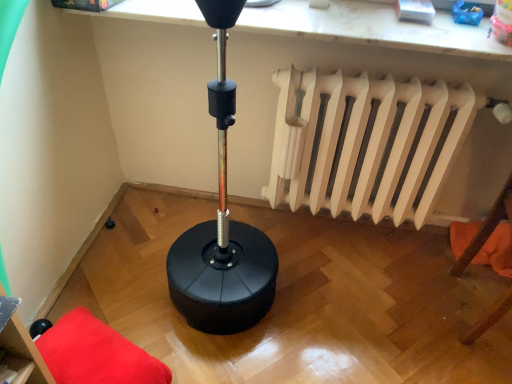
Question: Does black rubber punching bag at upper center have a greater width compared to matte black stool at lower left, marked as the 2th furniture in a bottom-to-top arrangement?

Choices:
 (A) yes
 (B) no

Answer: (A)

Question: Can you confirm if black rubber punching bag at upper center is positioned to the right of matte black stool at lower left, marked as the 2th furniture in a bottom-to-top arrangement?

Choices:
 (A) yes
 (B) no

Answer: (A)

Question: Is black rubber punching bag at upper center further to the viewer compared to matte black stool at lower left, the 1th furniture positioned from the top?

Choices:
 (A) no
 (B) yes

Answer: (B)

Question: Is black rubber punching bag at upper center not inside matte black stool at lower left, marked as the 2th furniture in a bottom-to-top arrangement?

Choices:
 (A) no
 (B) yes

Answer: (B)

Question: Is black rubber punching bag at upper center thinner than matte black stool at lower left, the second furniture in the back-to-front sequence?

Choices:
 (A) yes
 (B) no

Answer: (B)

Question: Considering the relative positions of black rubber punching bag at upper center and velvet red cushion at lower left, positioned as the 1th furniture in bottom-to-top order, in the image provided, is black rubber punching bag at upper center to the left or to the right of velvet red cushion at lower left, positioned as the 1th furniture in bottom-to-top order,?

Choices:
 (A) right
 (B) left

Answer: (A)

Question: Which is correct: black rubber punching bag at upper center is inside velvet red cushion at lower left, placed as the 1th furniture when sorted from back to front, or outside of it?

Choices:
 (A) outside
 (B) inside

Answer: (A)

Question: From a real-world perspective, relative to velvet red cushion at lower left, placed as the 1th furniture when sorted from back to front, is black rubber punching bag at upper center vertically above or below?

Choices:
 (A) above
 (B) below

Answer: (A)

Question: Considering the positions of black rubber punching bag at upper center and velvet red cushion at lower left, placed as the 1th furniture when sorted from back to front, in the image, is black rubber punching bag at upper center wider or thinner than velvet red cushion at lower left, placed as the 1th furniture when sorted from back to front,?

Choices:
 (A) wide
 (B) thin

Answer: (B)

Question: Is velvet red cushion at lower left, which is the second furniture from front to back, bigger or smaller than white matte radiator at upper right?

Choices:
 (A) small
 (B) big

Answer: (A)

Question: Considering the positions of point (73, 362) and point (289, 175), is point (73, 362) closer or farther from the camera than point (289, 175)?

Choices:
 (A) closer
 (B) farther

Answer: (A)

Question: In the image, is velvet red cushion at lower left, which is the second furniture from front to back, positioned in front of or behind white matte radiator at upper right?

Choices:
 (A) behind
 (B) front

Answer: (B)

Question: Is velvet red cushion at lower left, positioned as the 1th furniture in bottom-to-top order, spatially inside white matte radiator at upper right, or outside of it?

Choices:
 (A) inside
 (B) outside

Answer: (B)

Question: Based on their sizes in the image, would you say orange fabric pillow at lower right is bigger or smaller than black rubber punching bag at upper center?

Choices:
 (A) small
 (B) big

Answer: (A)

Question: Considering the positions of point (490, 256) and point (157, 3), is point (490, 256) closer or farther from the camera than point (157, 3)?

Choices:
 (A) farther
 (B) closer

Answer: (A)